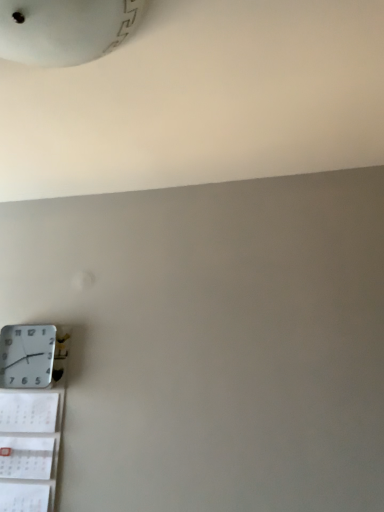
Question: Does white plastic wall clock at lower left lie behind white paper calendar at lower left?

Choices:
 (A) no
 (B) yes

Answer: (B)

Question: From the image's perspective, is white plastic wall clock at lower left located beneath white paper calendar at lower left?

Choices:
 (A) yes
 (B) no

Answer: (B)

Question: Does white plastic wall clock at lower left have a greater height compared to white paper calendar at lower left?

Choices:
 (A) yes
 (B) no

Answer: (B)

Question: Are white plastic wall clock at lower left and white paper calendar at lower left located far from each other?

Choices:
 (A) no
 (B) yes

Answer: (A)

Question: Does white plastic wall clock at lower left lie in front of white paper calendar at lower left?

Choices:
 (A) yes
 (B) no

Answer: (B)

Question: Is white plastic wall clock at lower left smaller than white paper calendar at lower left?

Choices:
 (A) yes
 (B) no

Answer: (A)

Question: From the image's perspective, is white paper calendar at lower left on white plastic wall clock at lower left?

Choices:
 (A) yes
 (B) no

Answer: (B)

Question: Considering the relative sizes of white paper calendar at lower left and white plastic wall clock at lower left in the image provided, is white paper calendar at lower left wider than white plastic wall clock at lower left?

Choices:
 (A) yes
 (B) no

Answer: (B)

Question: From a real-world perspective, is white paper calendar at lower left on top of white plastic wall clock at lower left?

Choices:
 (A) no
 (B) yes

Answer: (A)

Question: Is white paper calendar at lower left looking in the opposite direction of white plastic wall clock at lower left?

Choices:
 (A) no
 (B) yes

Answer: (A)

Question: Is white paper calendar at lower left located outside white plastic wall clock at lower left?

Choices:
 (A) yes
 (B) no

Answer: (A)

Question: From a real-world perspective, is white paper calendar at lower left below white plastic wall clock at lower left?

Choices:
 (A) no
 (B) yes

Answer: (B)

Question: Considering the positions of white plastic wall clock at lower left and white paper calendar at lower left in the image, is white plastic wall clock at lower left taller or shorter than white paper calendar at lower left?

Choices:
 (A) tall
 (B) short

Answer: (B)